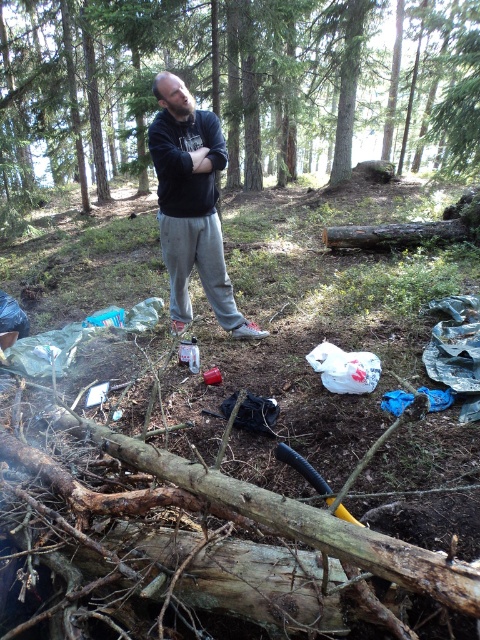
Question: Can you confirm if green matte tree at center is wider than black sweatshirt at center?

Choices:
 (A) no
 (B) yes

Answer: (B)

Question: Is green matte tree at center smaller than black sweatshirt at center?

Choices:
 (A) no
 (B) yes

Answer: (A)

Question: Can you confirm if green matte tree at center is positioned to the right of black sweatshirt at center?

Choices:
 (A) no
 (B) yes

Answer: (A)

Question: Which object appears farthest from the camera in this image?

Choices:
 (A) green matte tree at center
 (B) black sweatshirt at center

Answer: (A)